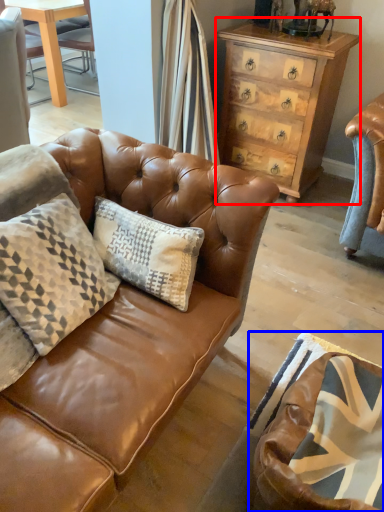
Question: Among these objects, which one is farthest to the camera, chest of drawers (highlighted by a red box) or swivel chair (highlighted by a blue box)?

Choices:
 (A) chest of drawers
 (B) swivel chair

Answer: (A)